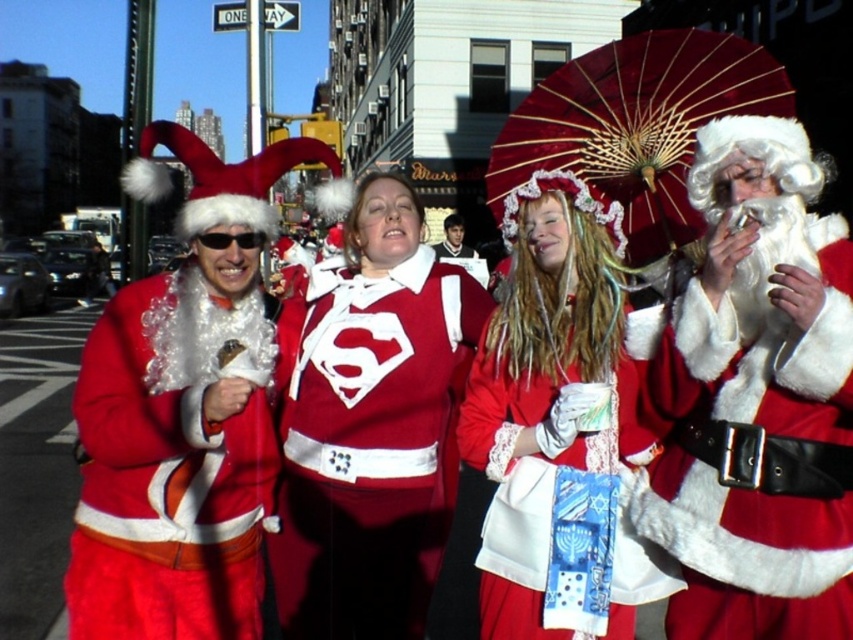
Question: Which point is farther to the camera?

Choices:
 (A) fuzzy red santa claus at left
 (B) white lace dress at center
 (C) smooth brown leather jacket at center
 (D) matte black sunglasses at center

Answer: (C)

Question: Which is nearer to the smooth brown leather jacket at center?

Choices:
 (A) fuzzy white santa at center
 (B) matte red sweater with white logo at center
 (C) white lace dress at center

Answer: (B)

Question: Is fuzzy red santa claus at left positioned behind matte black sunglasses at center?

Choices:
 (A) yes
 (B) no

Answer: (B)

Question: Which point is farther from the camera taking this photo?

Choices:
 (A) (688, 602)
 (B) (297, 582)
 (C) (456, 236)

Answer: (C)

Question: Does fuzzy red santa claus at left have a greater width compared to matte black sunglasses at center?

Choices:
 (A) yes
 (B) no

Answer: (A)

Question: Is white lace dress at center above smooth brown leather jacket at center?

Choices:
 (A) no
 (B) yes

Answer: (A)